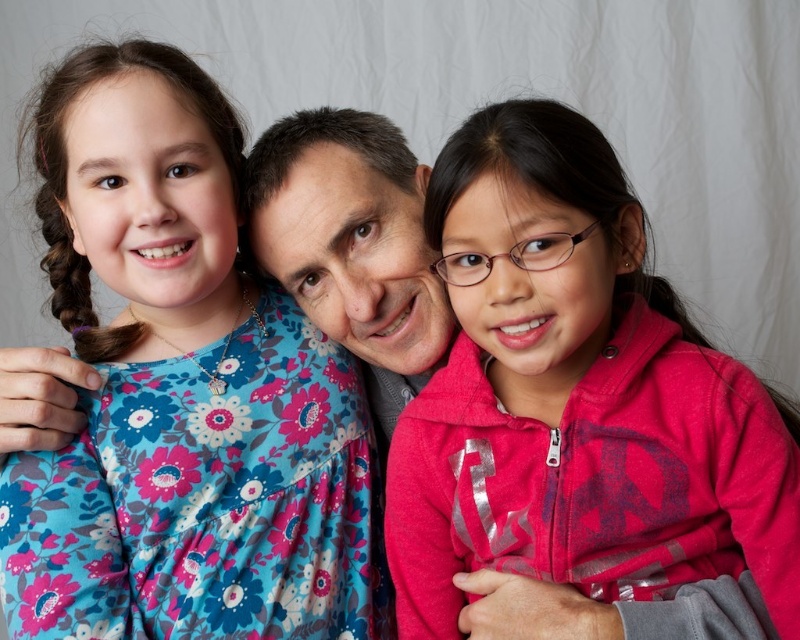
Question: From the image, what is the correct spatial relationship of floral fabric dress at upper left in relation to pink fleece jacket at center?

Choices:
 (A) right
 (B) left

Answer: (B)

Question: Can you confirm if floral fabric dress at upper left is positioned to the left of pink fleece jacket at center?

Choices:
 (A) no
 (B) yes

Answer: (B)

Question: Which object is closer to the camera taking this photo?

Choices:
 (A) floral fabric dress at upper left
 (B) pink fleece jacket at center

Answer: (B)

Question: Which point is farther to the camera?

Choices:
 (A) floral fabric dress at upper left
 (B) pink fleece jacket at center

Answer: (A)

Question: Can you confirm if floral fabric dress at upper left is thinner than pink fleece jacket at center?

Choices:
 (A) no
 (B) yes

Answer: (B)